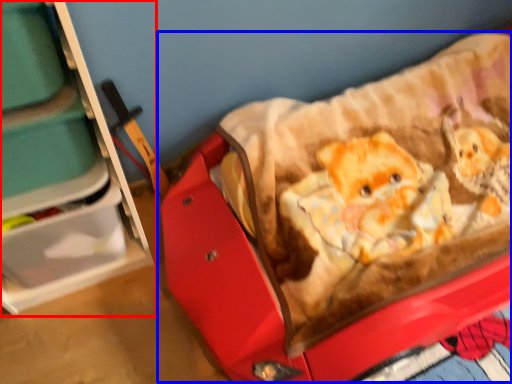
Question: Among these objects, which one is farthest to the camera, furniture (highlighted by a red box) or baby carriage (highlighted by a blue box)?

Choices:
 (A) furniture
 (B) baby carriage

Answer: (B)